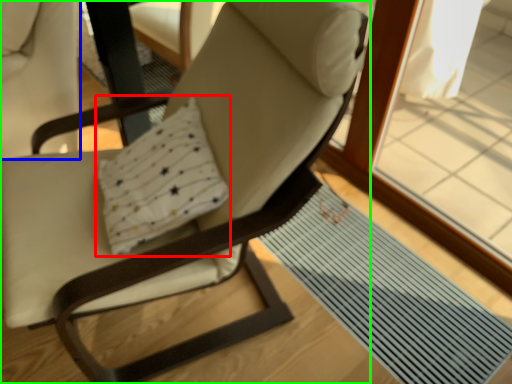
Question: Based on their relative distances, which object is nearer to pillow (highlighted by a red box)? Choose from swivel chair (highlighted by a blue box) and chair (highlighted by a green box).

Choices:
 (A) swivel chair
 (B) chair

Answer: (B)